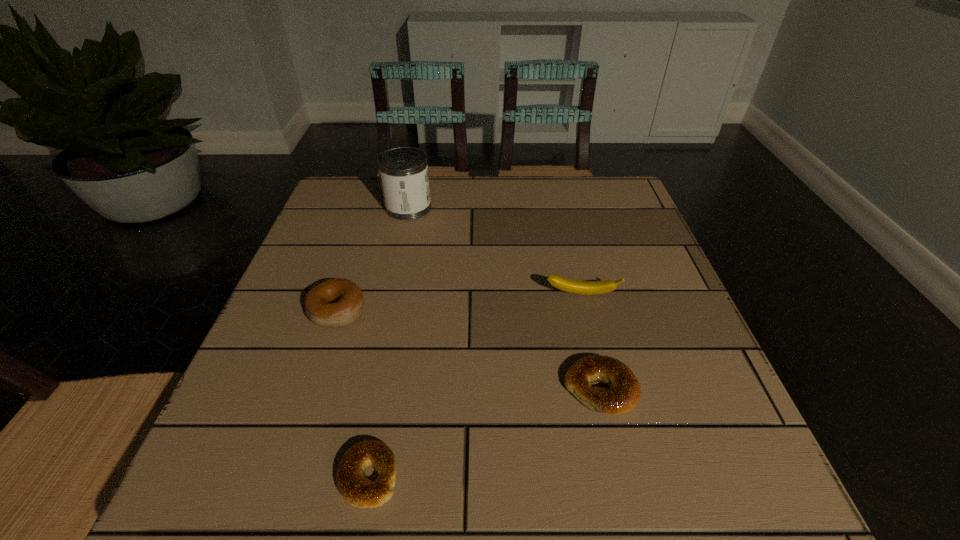
Find the location of `free space located 0.300m at the stem of the banana`. free space located 0.300m at the stem of the banana is located at coordinates (617, 440).

Image resolution: width=960 pixels, height=540 pixels. I want to click on free spot located on the front of the leftmost bagel, so click(280, 484).

In order to click on vacant space located 0.400m on the back of the second nearest bagel in this screenshot , I will do `click(563, 229)`.

You are a GUI agent. You are given a task and a screenshot of the screen. Output one action in this format:
    pyautogui.click(x=<x>, y=<y>)
    Task: Click on the free space located on the back of the shortest object
    
    Given the screenshot: What is the action you would take?
    pyautogui.click(x=384, y=388)

I want to click on object situated at the far edge, so click(403, 171).

Identify the location of object located in the near edge section of the desktop. (356, 489).

Locate an element on the screen. can located at the left edge is located at coordinates (403, 171).

Identify the location of bagel at the left edge. (333, 303).

You are a GUI agent. You are given a task and a screenshot of the screen. Output one action in this format:
    pyautogui.click(x=<x>, y=<y>)
    Task: Click on the banana located in the right edge section of the desktop
    This screenshot has height=540, width=960.
    Given the screenshot: What is the action you would take?
    pyautogui.click(x=572, y=286)

You are a GUI agent. You are given a task and a screenshot of the screen. Output one action in this format:
    pyautogui.click(x=<x>, y=<y>)
    Task: Click on the bagel that is positioned at the right edge
    The image size is (960, 540).
    Given the screenshot: What is the action you would take?
    pyautogui.click(x=624, y=391)